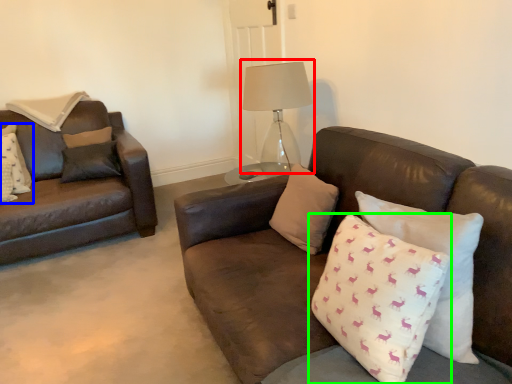
Question: Which is farther away from table lamp (highlighted by a red box)? pillow (highlighted by a blue box) or pillow (highlighted by a green box)?

Choices:
 (A) pillow
 (B) pillow

Answer: (A)